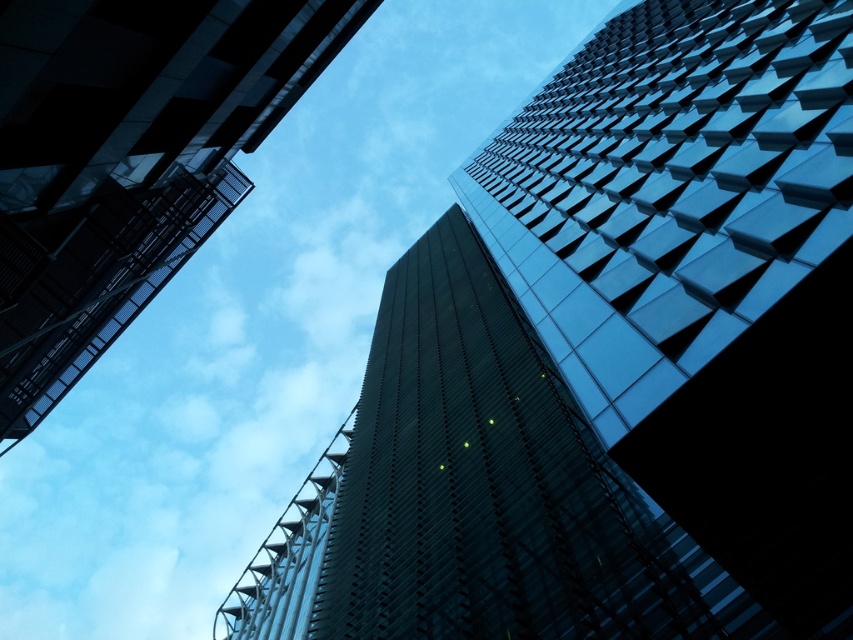
Is glassy reflective skyscraper at center thinner than glassy reflective skyscraper at upper left?

Incorrect, glassy reflective skyscraper at center's width is not less than glassy reflective skyscraper at upper left's.

Does point (512, 548) lie behind point (184, 36)?

Yes, it is.

Is point (486, 566) in front of point (91, 349)?

Yes, point (486, 566) is closer to viewer.

You are a GUI agent. You are given a task and a screenshot of the screen. Output one action in this format:
    pyautogui.click(x=<x>, y=<y>)
    Task: Click on the glassy reflective skyscraper at center
    This screenshot has height=640, width=853.
    Given the screenshot: What is the action you would take?
    pyautogui.click(x=608, y=362)